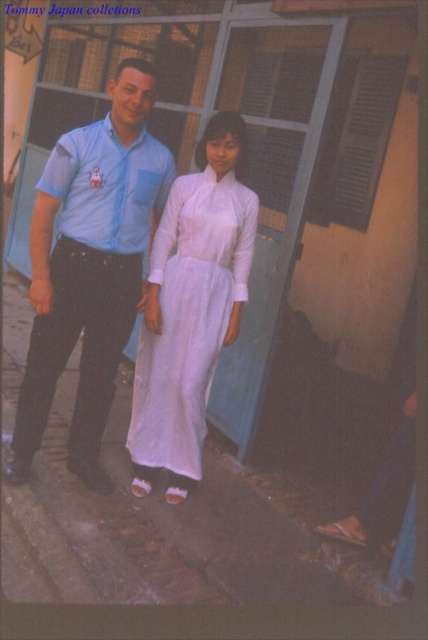
Consider the image. You are a photographer trying to capture a portrait of both the matte blue shirt at center and the white silk dress at center in the same frame. Considering their heights, which one should you position closer to the camera to ensure both are fully visible in the photo?

Since the matte blue shirt at center is much taller than the white silk dress at center, you should position the white silk dress at center closer to the camera to ensure both are fully visible in the photo.

You are a photographer trying to capture a portrait of the matte blue shirt at center and the white silk dress at center. The minimum focusing distance for your camera is 16 inches. Will you need to adjust your position to ensure both subjects are in focus?

The matte blue shirt at center is 15.89 inches away from the white silk dress at center, which is less than the camera minimum focusing distance of 16 inches. Therefore, you need to move further away to ensure both subjects are in focus.

You are a photographer standing 10 feet away from the two people in the scene. You want to take a photo that includes both the white silk dress at center and the matte blue shirt at left without any part of them being cut off. What is the minimum width of your camera lens in inches to capture both subjects?

The white silk dress at center and the matte blue shirt at left are 19.91 inches apart. To capture both subjects without any part being cut off, the camera lens must be at least 19.91 inches wide.